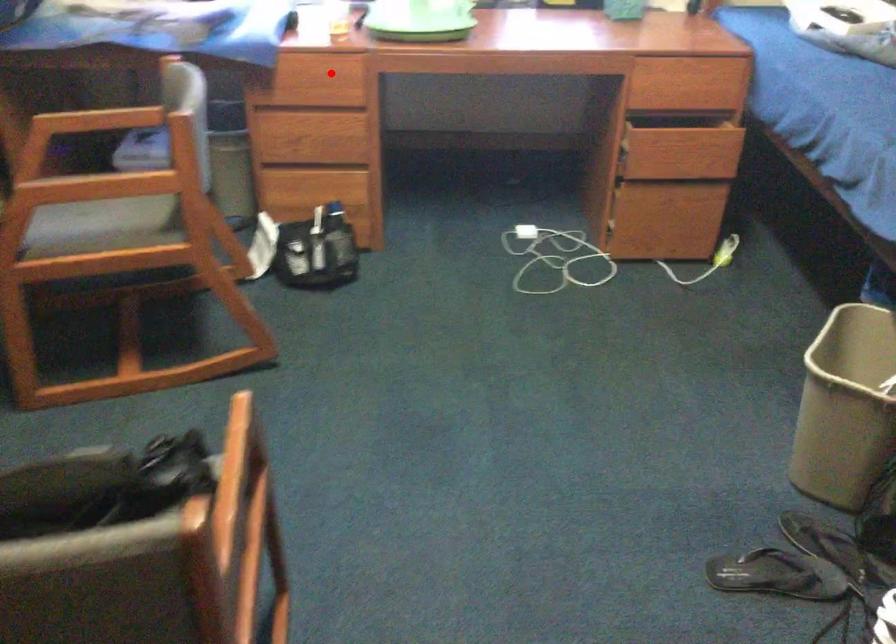
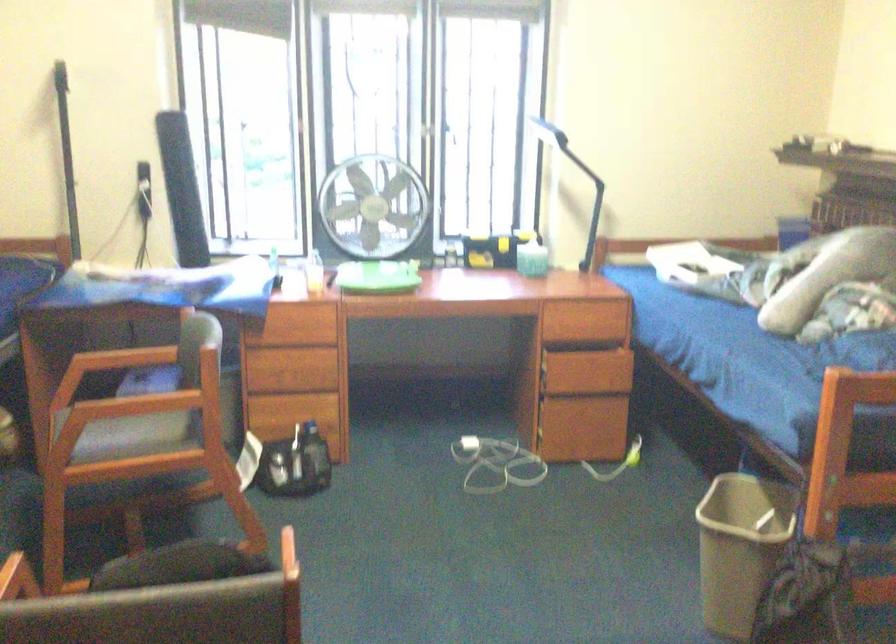
Question: A red point is marked in image1. In image2, is the corresponding 3D point closer to the camera or farther? Reply with the corresponding letter.

Choices:
 (A) The corresponding 3D point is closer.
 (B) The corresponding 3D point is farther.

Answer: (B)